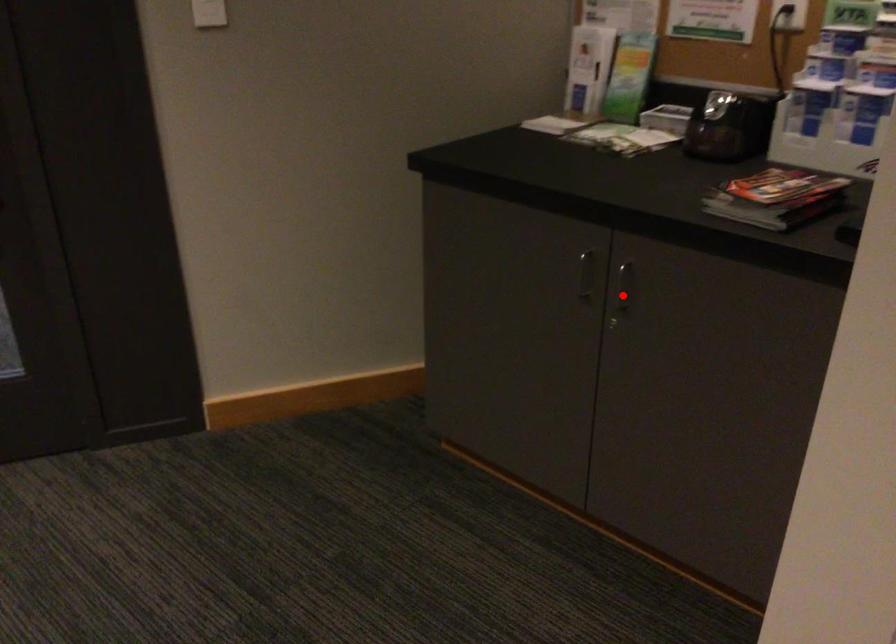
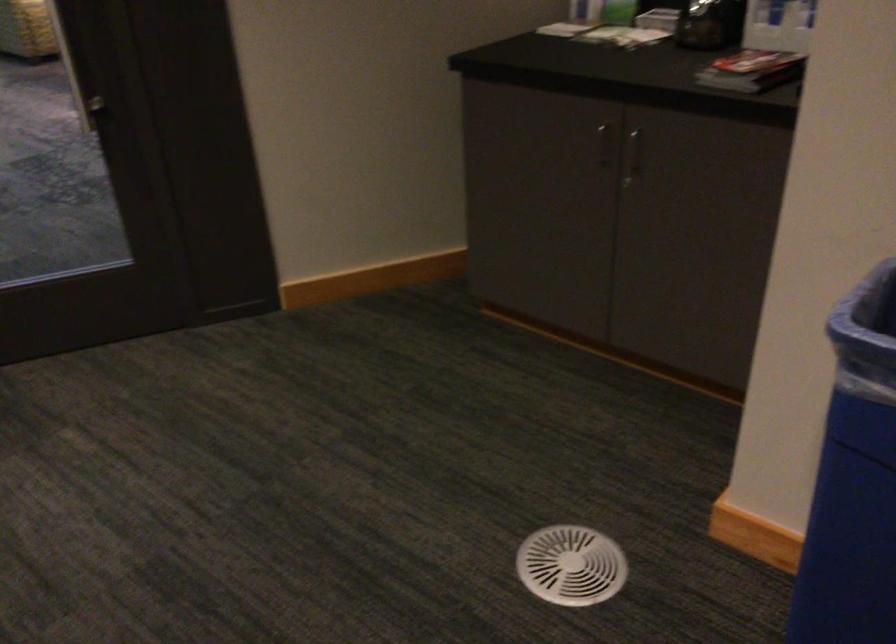
Question: I am providing you with two images of the same scene from different viewpoints. Given a red point in image1, look at the same physical point in image2. Is it:

Choices:
 (A) Closer to the viewpoint
 (B) Farther from the viewpoint

Answer: (B)